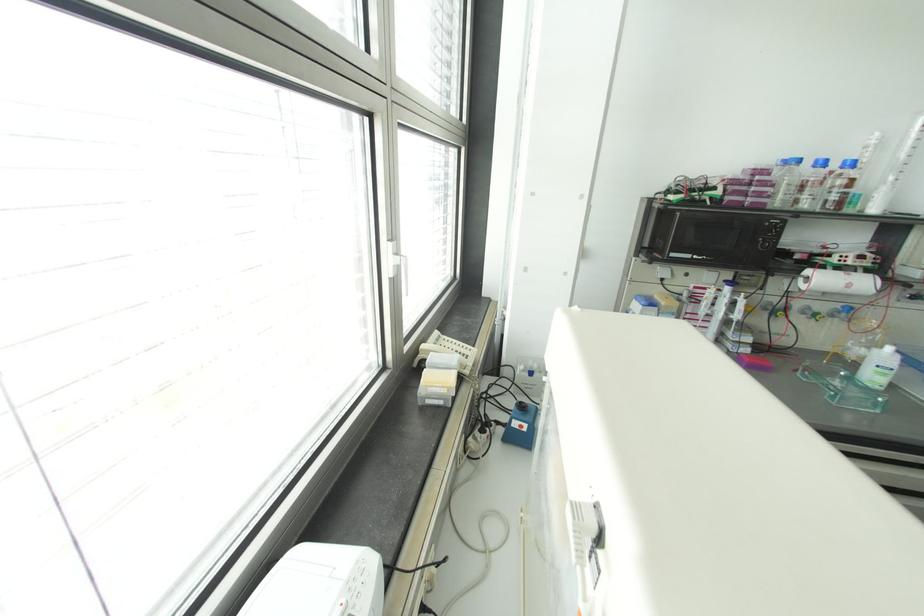
Image resolution: width=924 pixels, height=616 pixels. In order to click on graduated cylinder in this screenshot , I will do `click(910, 182)`.